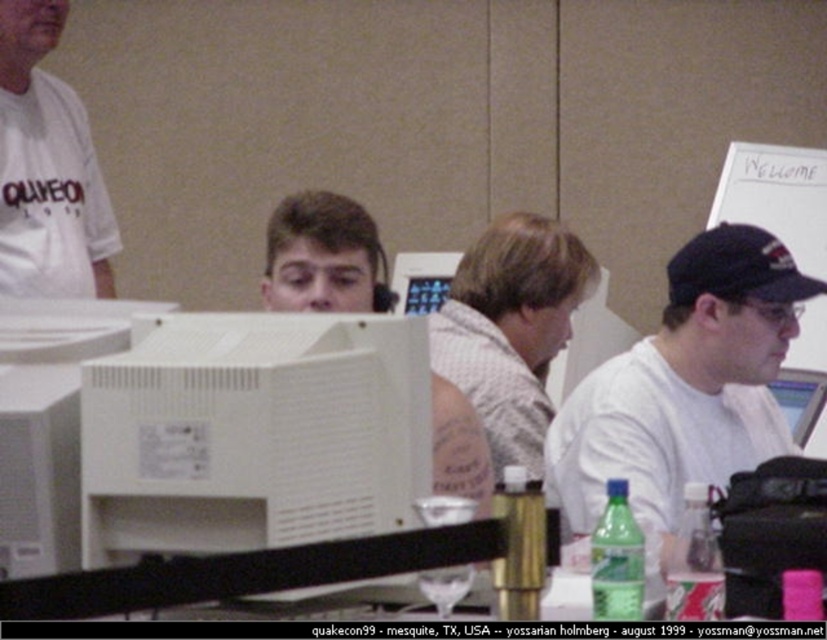
Question: Estimate the real-world distances between objects in this image. Which object is farther from the white plastic monitor at center?

Choices:
 (A) white matte t-shirt at upper left
 (B) white plastic desktop computer at center

Answer: (B)

Question: Which of the following is the closest to the observer?

Choices:
 (A) white plastic desktop computer at center
 (B) white textured shirt at center
 (C) white matte t-shirt at upper left

Answer: (A)

Question: In this image, where is white matte shirt at center located relative to white textured shirt at center?

Choices:
 (A) left
 (B) right

Answer: (B)

Question: Is the position of white plastic desktop computer at center less distant than that of white matte t-shirt at upper left?

Choices:
 (A) no
 (B) yes

Answer: (B)

Question: Which point is closer to the camera taking this photo?

Choices:
 (A) (438, 342)
 (B) (753, 449)
 (C) (386, 492)

Answer: (C)

Question: Does white plastic desktop computer at center appear on the right side of white matte shirt at center?

Choices:
 (A) no
 (B) yes

Answer: (A)